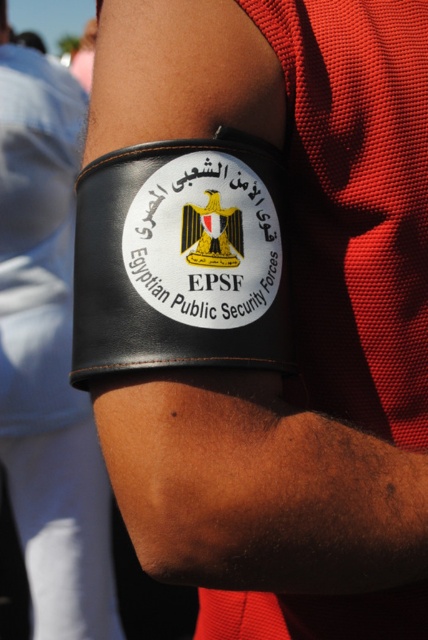
Does black leather patch at center have a larger size compared to black leather patch at upper center?

Indeed, black leather patch at center has a larger size compared to black leather patch at upper center.

Can you confirm if black leather patch at center is positioned below black leather patch at upper center?

Yes, black leather patch at center is below black leather patch at upper center.

Who is more distant from viewer, (149, 161) or (216, 285)?

Positioned behind is point (216, 285).

Identify the location of black leather patch at center. The height and width of the screenshot is (640, 428). (181, 259).

Does point (68, 419) lie in front of point (145, 237)?

No, (68, 419) is behind (145, 237).

Which is below, black leather armband at center or black leather patch at upper center?

Positioned lower is black leather armband at center.

Image resolution: width=428 pixels, height=640 pixels. In order to click on black leather armband at center in this screenshot , I will do `click(47, 355)`.

The width and height of the screenshot is (428, 640). I want to click on black leather armband at center, so click(47, 355).

Measure the distance from black leather armband at center to black leather patch at center.

A distance of 1.69 meters exists between black leather armband at center and black leather patch at center.

Between black leather armband at center and black leather patch at center, which one has less height?

black leather patch at center

Between point (39, 316) and point (107, 337), which one is positioned behind?

The point (39, 316) is behind.

Where is `black leather armband at center`? black leather armband at center is located at coordinates (47, 355).